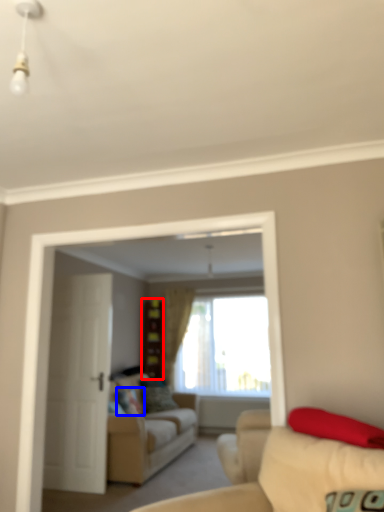
Question: Which point is closer to the camera, dresser (highlighted by a red box) or pillow (highlighted by a blue box)?

Choices:
 (A) dresser
 (B) pillow

Answer: (B)